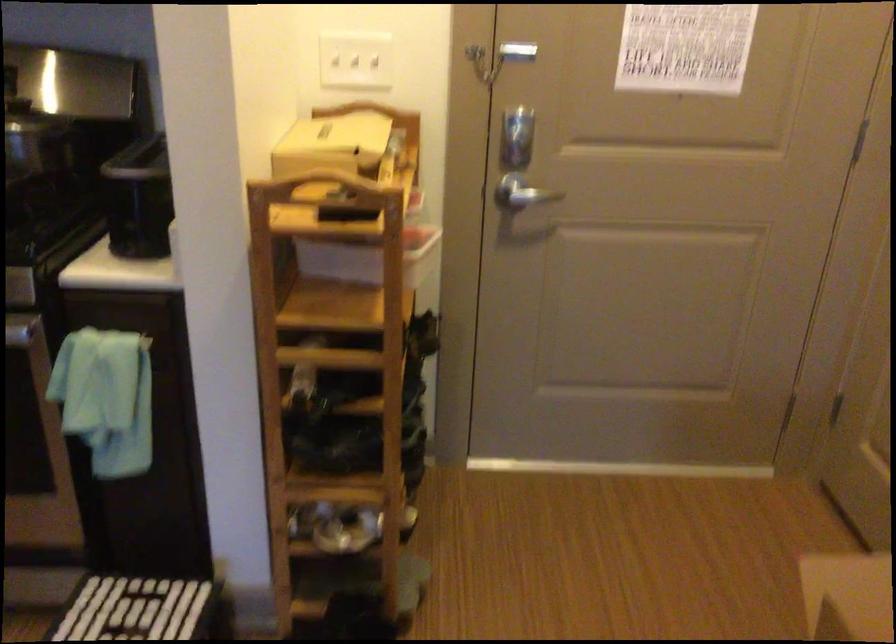
Find the location of a particular element. This screenshot has height=644, width=896. white light switch is located at coordinates (356, 61).